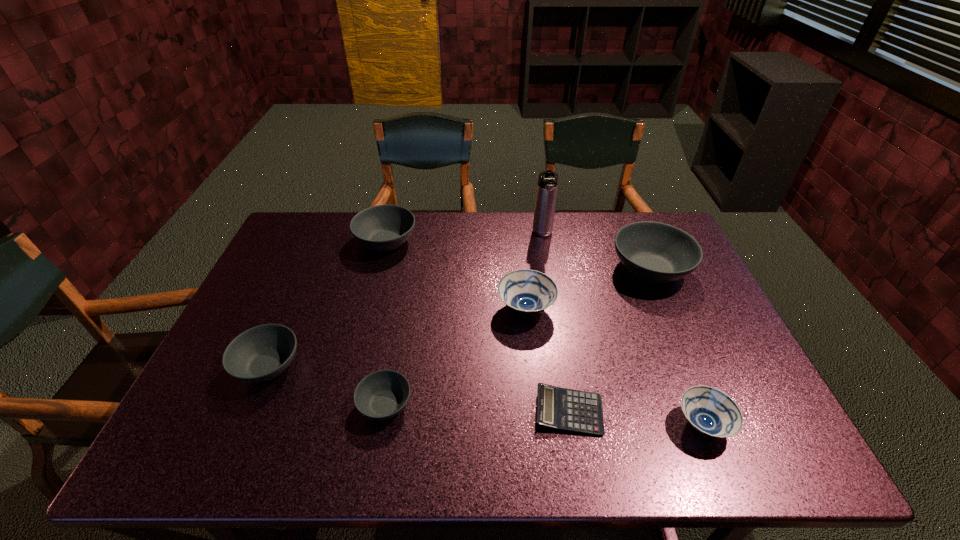
You are a GUI agent. You are given a task and a screenshot of the screen. Output one action in this format:
    pyautogui.click(x=<x>, y=<y>)
    Task: Click on the free space at the far left corner of the desktop
    This screenshot has width=960, height=540.
    Given the screenshot: What is the action you would take?
    pyautogui.click(x=327, y=239)

I want to click on free region at the near right corner, so click(770, 440).

Where is `empty location between the right blue soup bowl and the thermos bottle`? The image size is (960, 540). empty location between the right blue soup bowl and the thermos bottle is located at coordinates (623, 329).

In order to click on free space between the smaller blue soup bowl and the leftmost gray soup bowl in this screenshot , I will do `click(486, 395)`.

Find the location of `unoccupied area between the shortest soup bowl and the thermos bottle`. unoccupied area between the shortest soup bowl and the thermos bottle is located at coordinates (464, 319).

You are a GUI agent. You are given a task and a screenshot of the screen. Output one action in this format:
    pyautogui.click(x=<x>, y=<y>)
    Task: Click on the vacant area between the right blue soup bowl and the farther blue soup bowl
    
    Given the screenshot: What is the action you would take?
    pyautogui.click(x=614, y=367)

Identify the location of unoccupied area between the thermos bottle and the seventh shortest object. (596, 252).

This screenshot has height=540, width=960. In order to click on empty space between the smaller blue soup bowl and the leftmost object in this screenshot , I will do `click(486, 395)`.

At what (x,y) coordinates should I click in order to perform the action: click on vacant space that's between the leftmost gray soup bowl and the right blue soup bowl. Please return your answer as a coordinate pair (x, y). Looking at the image, I should click on (486, 395).

Where is `empty location between the second biggest gray soup bowl and the bigger blue soup bowl`? This screenshot has width=960, height=540. empty location between the second biggest gray soup bowl and the bigger blue soup bowl is located at coordinates (456, 275).